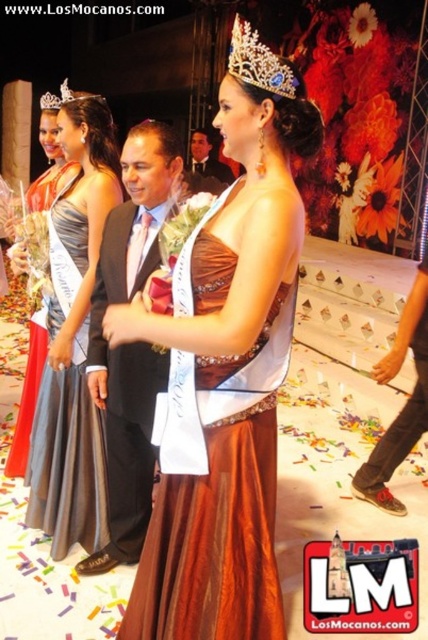
Which is above, dark suit at center or diamond encrusted tiara at upper center?

diamond encrusted tiara at upper center

Between dark suit at center and diamond encrusted tiara at upper center, which one appears on the right side from the viewer's perspective?

Positioned to the right is diamond encrusted tiara at upper center.

Which is behind, point (136, 364) or point (231, 51)?

The point (231, 51) is behind.

Find the location of a particular element. dark suit at center is located at coordinates pos(130,342).

Where is `satin silver dress at left`? This screenshot has width=428, height=640. satin silver dress at left is located at coordinates (68, 456).

Which of these two, satin silver dress at left or silver metallic tiara at upper center, stands taller?

With more height is silver metallic tiara at upper center.

The height and width of the screenshot is (640, 428). What do you see at coordinates (68, 456) in the screenshot?
I see `satin silver dress at left` at bounding box center [68, 456].

You are a GUI agent. You are given a task and a screenshot of the screen. Output one action in this format:
    pyautogui.click(x=<x>, y=<y>)
    Task: Click on the satin silver dress at left
    The image size is (428, 640).
    Given the screenshot: What is the action you would take?
    pyautogui.click(x=68, y=456)

The image size is (428, 640). I want to click on satin silver dress at left, so point(68,456).